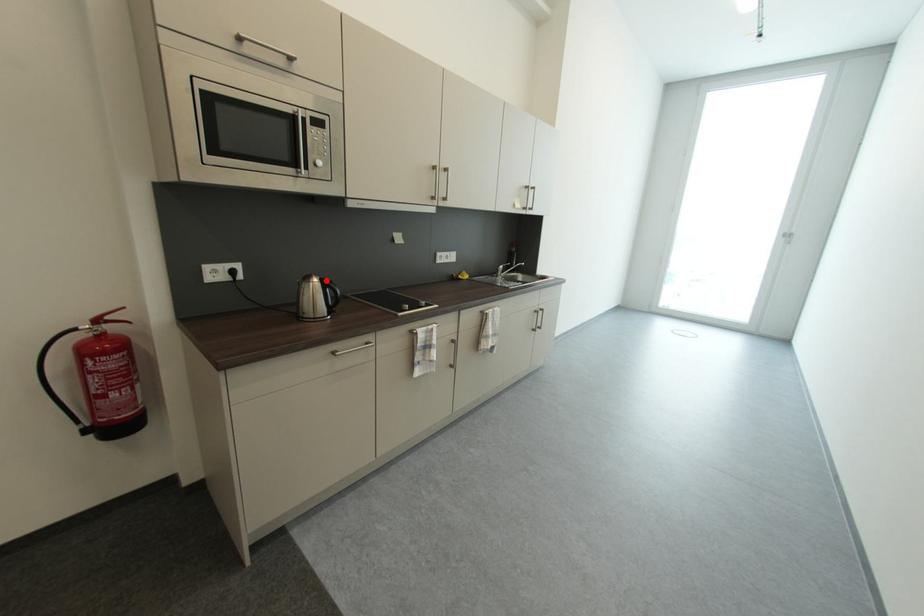
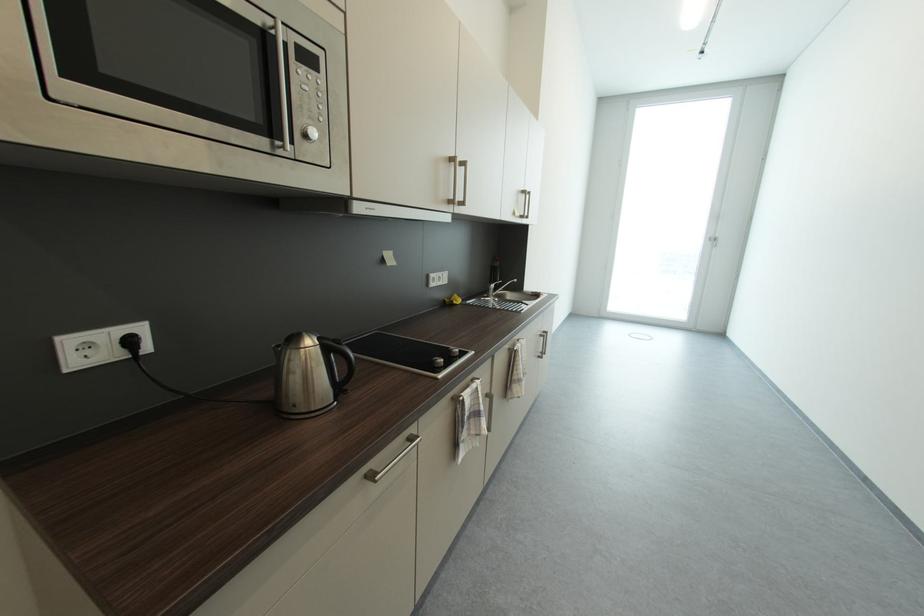
Question: A red point is marked in image1. In image2, is the corresponding 3D point closer to the camera or farther? Reply with the corresponding letter.

Choices:
 (A) The corresponding 3D point is closer.
 (B) The corresponding 3D point is farther.

Answer: (B)